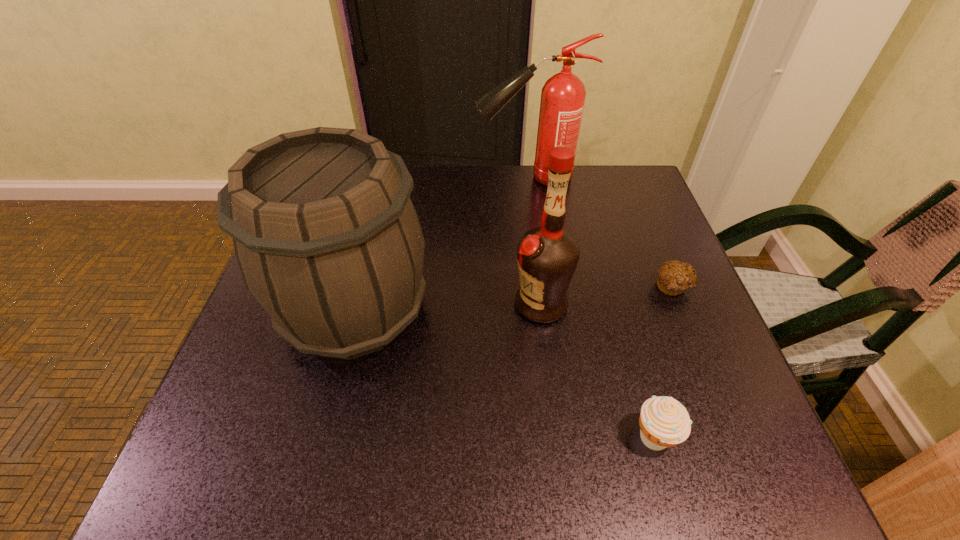
Where is `free location that satisfies the following two spatial constraints: 1. on the back side of the taller muffin; 2. on the front and back of the liquor`? This screenshot has height=540, width=960. free location that satisfies the following two spatial constraints: 1. on the back side of the taller muffin; 2. on the front and back of the liquor is located at coordinates (617, 304).